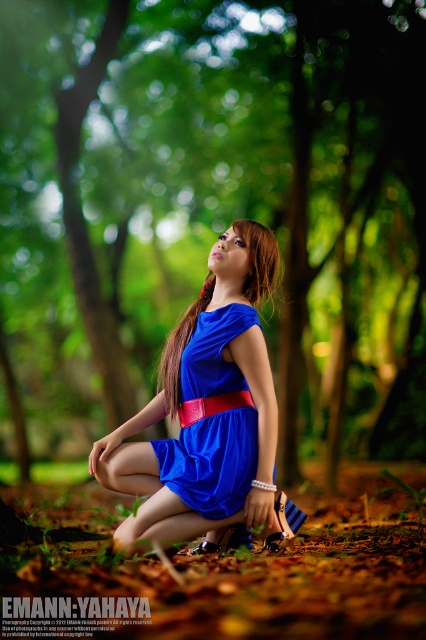
You are a fashion designer observing this forest scene. You want to ensure that the blue matte dress at center and brown smooth hair at center are not too close to each other in the image. Given that the minimum recommended distance between clothing and hair in fashion photography is 15 centimeters, can you confirm if the current positioning meets this requirement?

The distance between the blue matte dress at center and brown smooth hair at center is 16.40 centimeters, which exceeds the minimum recommended 15 centimeters. Therefore, the positioning meets the requirement.

You are a photographer trying to focus on the blue matte dress at center in the image. The camera has a focus point at coordinate point (207, 410). Is this focus point correctly placed to capture the blue matte dress at center?

Yes, the focus point at (207, 410) is correctly placed to capture the blue matte dress at center because the point marks exactly where the blue matte dress at center is located.